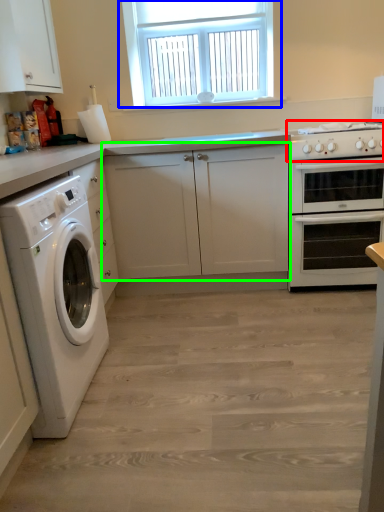
Question: Which object is positioned closest to gas stove (highlighted by a red box)? Select from window (highlighted by a blue box) and cabinetry (highlighted by a green box).

Choices:
 (A) window
 (B) cabinetry

Answer: (B)